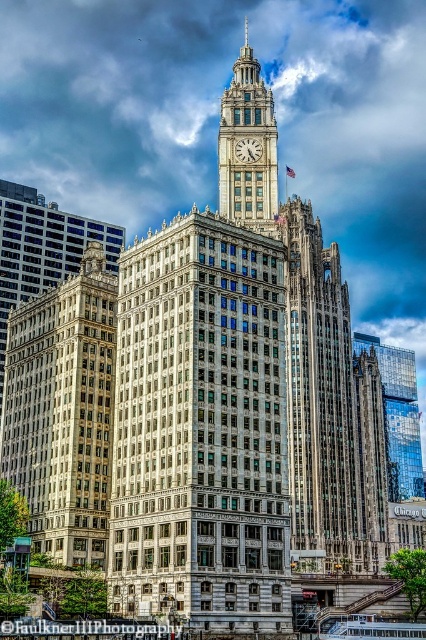
Measure the distance between gold/bronze stone building at left and camera.

A distance of 62.35 meters exists between gold/bronze stone building at left and camera.

Is gold/bronze stone building at left positioned behind beige stone clock tower at center?

No, gold/bronze stone building at left is closer to the viewer.

Between point (17, 424) and point (224, 120), which one is positioned behind?

The point (224, 120) is behind.

Find the location of a particular element. gold/bronze stone building at left is located at coordinates (63, 412).

Locate an element on the screen. The height and width of the screenshot is (640, 426). beige stone clock tower at center is located at coordinates (247, 147).

Which is behind, point (247, 56) or point (261, 147)?

Positioned behind is point (247, 56).

Locate an element on the screen. The image size is (426, 640). beige stone clock tower at center is located at coordinates (247, 147).

Which of these two, gold/bronze stone building at left or white marble clock at center, stands taller?

gold/bronze stone building at left

Is point (89, 531) farther from camera compared to point (244, 145)?

No, it is in front of (244, 145).

This screenshot has height=640, width=426. Identify the location of gold/bronze stone building at left. (63, 412).